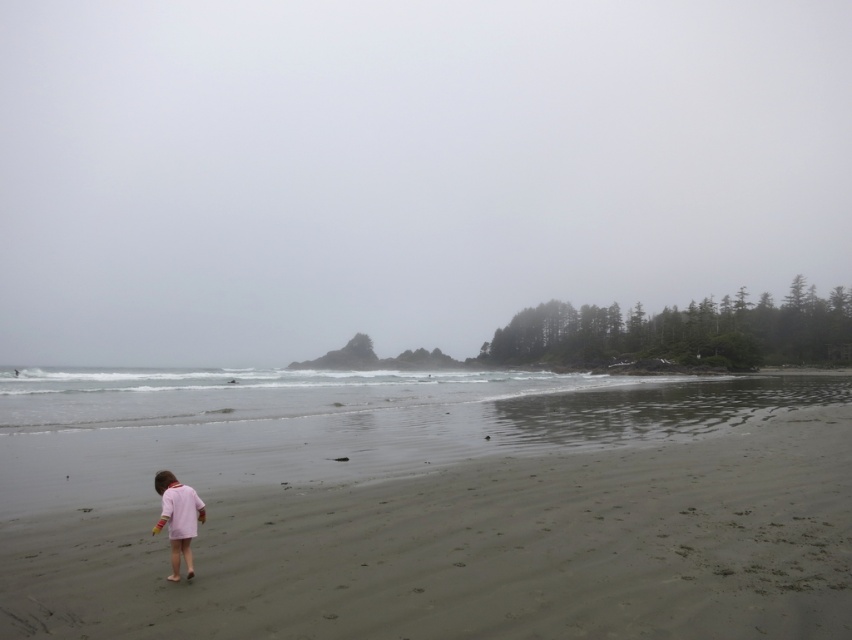
Question: Does smooth sand at lower center have a smaller size compared to pink matte dress at lower left?

Choices:
 (A) no
 (B) yes

Answer: (A)

Question: Does foggy sky at upper center have a greater width compared to pink matte dress at lower left?

Choices:
 (A) yes
 (B) no

Answer: (A)

Question: Which point appears farthest from the camera in this image?

Choices:
 (A) (170, 484)
 (B) (795, 435)
 (C) (398, 195)

Answer: (C)

Question: Which object is the closest to the foggy sky at upper center?

Choices:
 (A) pink matte dress at lower left
 (B) smooth sand at lower center

Answer: (B)

Question: Does smooth sand at lower center have a smaller size compared to pink matte dress at lower left?

Choices:
 (A) no
 (B) yes

Answer: (A)

Question: Estimate the real-world distances between objects in this image. Which object is farther from the smooth sand at lower center?

Choices:
 (A) pink matte dress at lower left
 (B) foggy sky at upper center

Answer: (B)